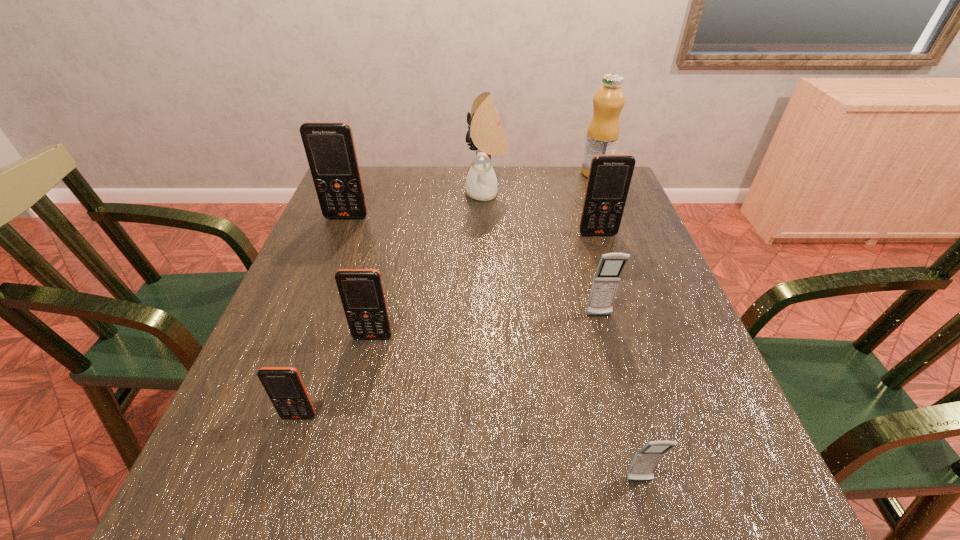
You are a GUI agent. You are given a task and a screenshot of the screen. Output one action in this format:
    pyautogui.click(x=<x>, y=<y>)
    Task: Click on the object that is positioned at the far right corner
    The image size is (960, 540).
    Given the screenshot: What is the action you would take?
    pyautogui.click(x=603, y=131)

The image size is (960, 540). In order to click on vacant region at the far edge of the desktop in this screenshot , I will do `click(504, 170)`.

In the image, there is a desktop. Where is `free space at the near edge`? The height and width of the screenshot is (540, 960). free space at the near edge is located at coordinates (472, 527).

In the image, there is a desktop. What are the coordinates of `vacant space at the left edge` in the screenshot? It's located at 351,259.

The height and width of the screenshot is (540, 960). In order to click on free space at the far right corner of the desktop in this screenshot , I will do `click(576, 166)`.

Where is `vacant area between the fifth nearest cellular telephone and the third farthest orange cellular telephone`? The height and width of the screenshot is (540, 960). vacant area between the fifth nearest cellular telephone and the third farthest orange cellular telephone is located at coordinates (486, 285).

Identify the location of free space that is in between the third farthest orange cellular telephone and the fruit juice. (484, 255).

At what (x,y) coordinates should I click in order to perform the action: click on vacant space in between the nearest object and the smallest orange cellular telephone. Please return your answer as a coordinate pair (x, y). This screenshot has width=960, height=540. Looking at the image, I should click on (469, 449).

What are the coordinates of `free space between the nearest object and the biggest orange cellular telephone` in the screenshot? It's located at (493, 349).

Find the location of a particular element. Image resolution: width=960 pixels, height=540 pixels. vacant area between the fruit juice and the second nearest cellular telephone is located at coordinates click(x=447, y=294).